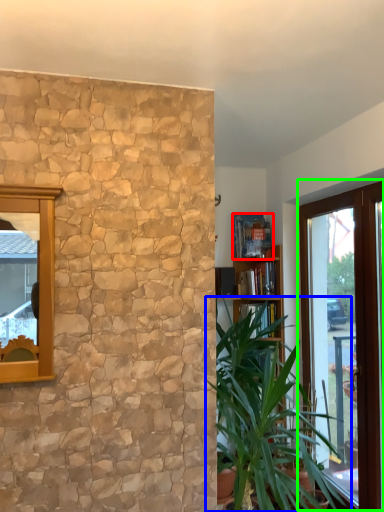
Question: Which object is the closest to the book (highlighted by a red box)? Choose among these: houseplant (highlighted by a blue box) or window (highlighted by a green box).

Choices:
 (A) houseplant
 (B) window

Answer: (B)